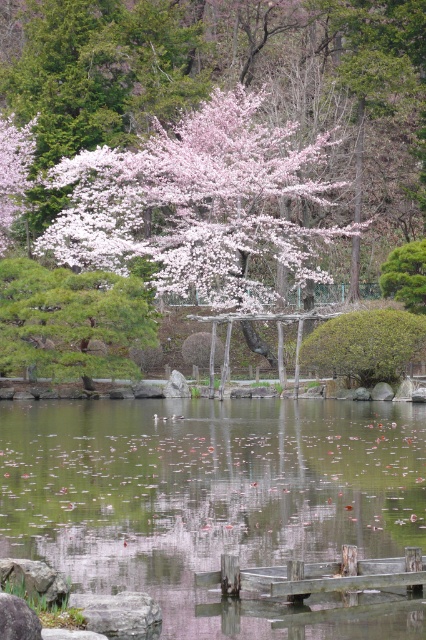
Question: Does pink blossoms at center appear under pink blossoms at upper left?

Choices:
 (A) no
 (B) yes

Answer: (B)

Question: Can you confirm if pink matte tree at center is positioned below transparent water at center?

Choices:
 (A) no
 (B) yes

Answer: (A)

Question: Which of these objects is positioned farthest from the pink blossoms at upper left?

Choices:
 (A) transparent water at center
 (B) pink matte tree at center

Answer: (A)

Question: Which point is farther to the camera?

Choices:
 (A) transparent water at center
 (B) pink blossoms at center

Answer: (B)

Question: Which point is farther to the camera?

Choices:
 (A) (31, 320)
 (B) (94, 211)
 (C) (154, 625)

Answer: (B)

Question: Can you confirm if transparent water at center is positioned below gray rough stone at lower left?

Choices:
 (A) yes
 (B) no

Answer: (A)